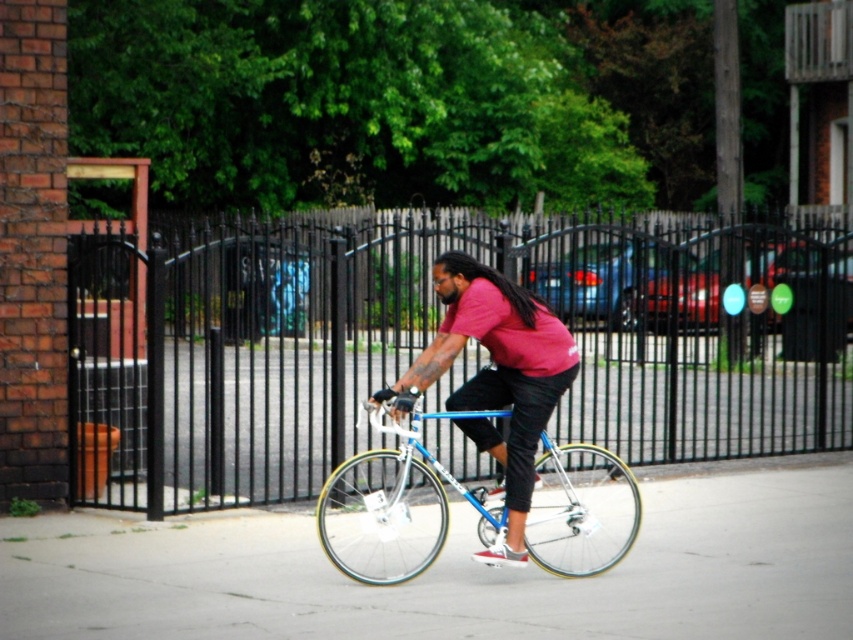
You are a cyclist approaching a black metal fence at center and a gray concrete pavement at center. The distance between them is crucial for planning your path. Can you safely navigate between them if your bicycle has a turning radius of 10 meters?

The black metal fence at center is 9.31 meters from the gray concrete pavement at center. Since the distance between them is less than your bicycle turning radius of 10 meters, you can safely navigate between them.

You are a delivery person who needs to pass through the space between the black metal fence at center and another object. Can your delivery van, which is 2 meters wide, fit through the gap if the matte blue bicycle at center is parked there?

The black metal fence at center is wider than the matte blue bicycle at center. However, the exact width of the gap isn

In the scene shown: You are a delivery person who needs to park your matte blue bicycle at center on the gray concrete pavement at center. Can the bicycle fit entirely on the pavement without any part hanging off the edge?

The gray concrete pavement at center is wider than the matte blue bicycle at center, so yes, the bicycle can fit entirely on the pavement without any part hanging off the edge.